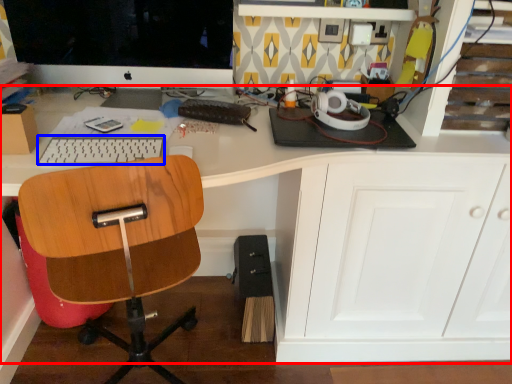
Question: Which object is closer to the camera taking this photo, desk (highlighted by a red box) or keyboard (highlighted by a blue box)?

Choices:
 (A) desk
 (B) keyboard

Answer: (A)